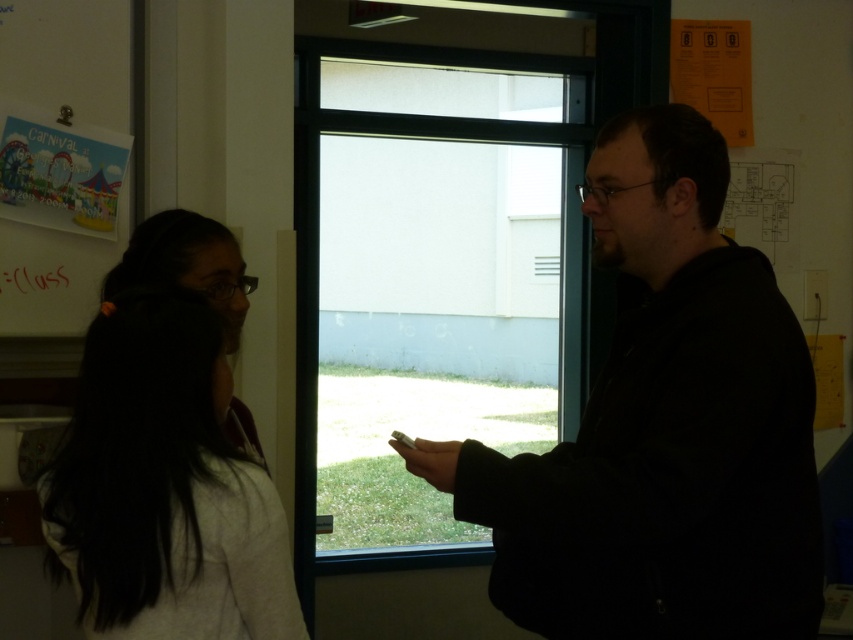
Who is taller, transparent glass window at center or matte paper poster at left?

With more height is transparent glass window at center.

Can you confirm if transparent glass window at center is thinner than matte paper poster at left?

No, transparent glass window at center is not thinner than matte paper poster at left.

I want to click on transparent glass window at center, so click(437, 273).

Where is `transparent glass window at center`? Image resolution: width=853 pixels, height=640 pixels. transparent glass window at center is located at coordinates (437, 273).

Who is taller, white matte hair at left or matte paper poster at left?

matte paper poster at left

I want to click on white matte hair at left, so click(152, 499).

Which is below, black matte jacket at right or matte paper poster at left?

black matte jacket at right is lower down.

Is black matte jacket at right to the left of matte paper poster at left from the viewer's perspective?

No, black matte jacket at right is not to the left of matte paper poster at left.

The width and height of the screenshot is (853, 640). What are the coordinates of `black matte jacket at right` in the screenshot? It's located at click(662, 428).

Locate an element on the screen. This screenshot has height=640, width=853. black matte jacket at right is located at coordinates (662, 428).